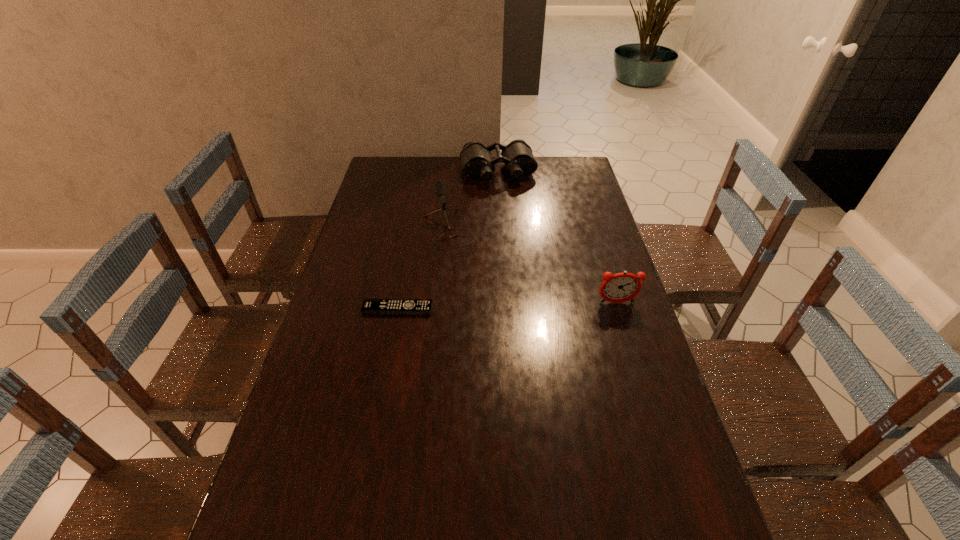
Image resolution: width=960 pixels, height=540 pixels. Identify the location of the shortest object. (370, 306).

This screenshot has width=960, height=540. I want to click on alarm clock, so click(621, 287).

Identify the location of microphone. (440, 187).

Where is `the farthest object`? Image resolution: width=960 pixels, height=540 pixels. the farthest object is located at coordinates (477, 163).

Locate an element on the screen. Image resolution: width=960 pixels, height=540 pixels. binoculars is located at coordinates (477, 163).

Where is `vacant region located on the front of the remote control`? The image size is (960, 540). vacant region located on the front of the remote control is located at coordinates (388, 363).

At what (x,y) coordinates should I click in order to perform the action: click on free space located on the front-facing side of the rightmost object. Please return your answer as a coordinate pair (x, y). The width and height of the screenshot is (960, 540). Looking at the image, I should click on (629, 343).

The height and width of the screenshot is (540, 960). Find the location of `blank space located on the stand of the third nearest object`. blank space located on the stand of the third nearest object is located at coordinates (467, 269).

Find the location of a particular element. This screenshot has height=540, width=960. free space located on the stand of the third nearest object is located at coordinates (466, 267).

In order to click on free point located 0.230m on the stand of the third nearest object in this screenshot , I will do `click(478, 293)`.